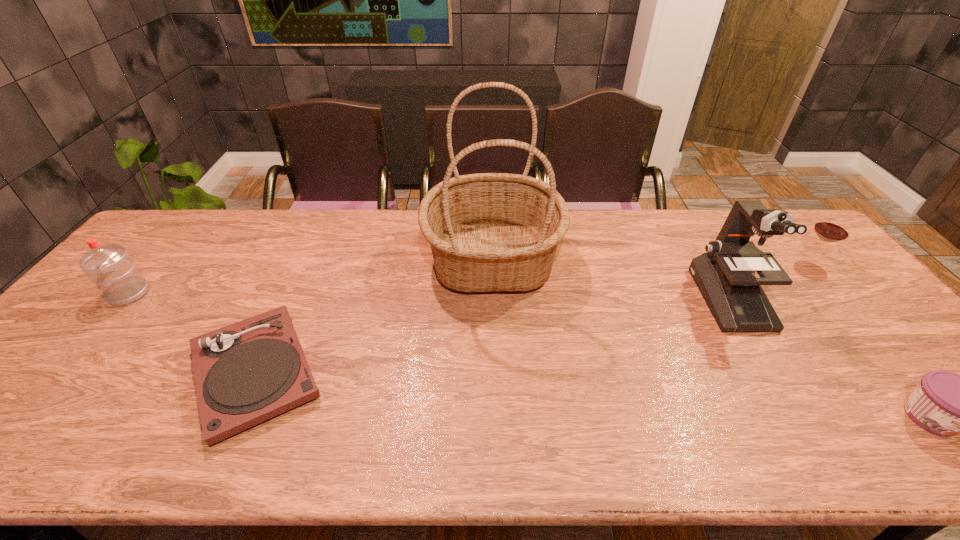
You are a GUI agent. You are given a task and a screenshot of the screen. Output one action in this format:
    pyautogui.click(x=<x>, y=<y>)
    Task: Click on the vacant area situated 0.120m through the eyepieces of the third object from right to left
    Image resolution: width=960 pixels, height=540 pixels.
    Given the screenshot: What is the action you would take?
    pyautogui.click(x=773, y=371)

I want to click on vacant area situated on the front of the wineglass, so click(x=850, y=308).

Locate an element on the screen. This screenshot has height=540, width=960. vacant space located 0.090m on the right of the second object from left to right is located at coordinates (368, 373).

Locate an element on the screen. object located at the far edge is located at coordinates (488, 232).

At what (x,y) coordinates should I click in order to perform the action: click on object that is at the near edge. Please return your answer as a coordinate pair (x, y). The width and height of the screenshot is (960, 540). Looking at the image, I should click on (250, 371).

At what (x,y) coordinates should I click in order to perform the action: click on object that is at the left edge. Please return your answer as a coordinate pair (x, y). The image size is (960, 540). Looking at the image, I should click on (116, 275).

The width and height of the screenshot is (960, 540). Find the location of `object at the right edge`. object at the right edge is located at coordinates (830, 228).

This screenshot has width=960, height=540. Identify the location of vacant space at the far edge of the desktop. (265, 227).

The image size is (960, 540). Find the location of `free space at the near edge of the desktop`. free space at the near edge of the desktop is located at coordinates (825, 454).

This screenshot has height=540, width=960. In the image, there is a desktop. In order to click on vacant space at the left edge in this screenshot , I will do `click(86, 346)`.